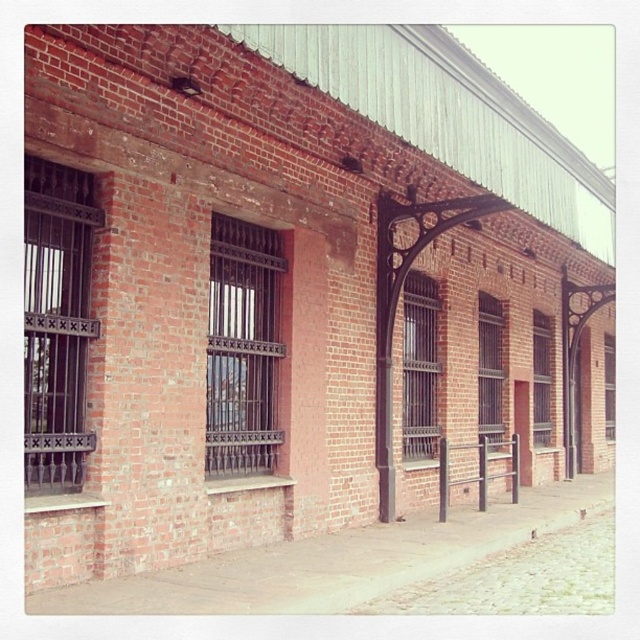
Question: Does matte black window at center come behind matte black bars at center?

Choices:
 (A) no
 (B) yes

Answer: (A)

Question: Among these points, which one is farthest from the camera?

Choices:
 (A) (612, 388)
 (B) (534, 394)
 (C) (259, 264)
 (D) (410, 275)

Answer: (A)

Question: Is brown concrete pavement at lower center thinner than dark brown wrought iron bars at left?

Choices:
 (A) no
 (B) yes

Answer: (A)

Question: Which point appears farthest from the camera in this image?

Choices:
 (A) (577, 476)
 (B) (545, 369)
 (C) (492, 413)

Answer: (A)

Question: Does brown concrete pavement at lower center lie in front of clear glass window at center?

Choices:
 (A) yes
 (B) no

Answer: (A)

Question: Which of the following is the closest to the observer?

Choices:
 (A) (538, 317)
 (B) (51, 435)

Answer: (B)